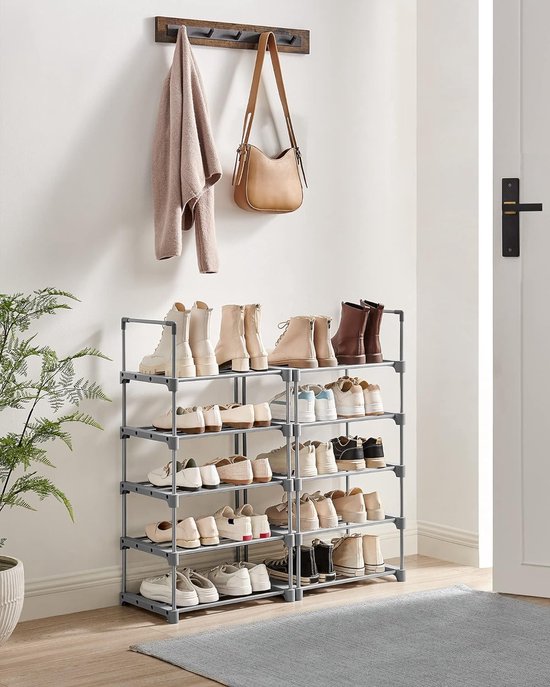
You are a GUI agent. You are given a task and a screenshot of the screen. Output one action in this format:
    pyautogui.click(x=<x>, y=<y>)
    Task: Click on the shelves
    Image resolution: width=550 pixels, height=687 pixels.
    Given the screenshot: What is the action you would take?
    pyautogui.click(x=223, y=605), pyautogui.click(x=204, y=550), pyautogui.click(x=213, y=486), pyautogui.click(x=226, y=431), pyautogui.click(x=225, y=371), pyautogui.click(x=331, y=370), pyautogui.click(x=346, y=416), pyautogui.click(x=343, y=475), pyautogui.click(x=342, y=528), pyautogui.click(x=342, y=578)